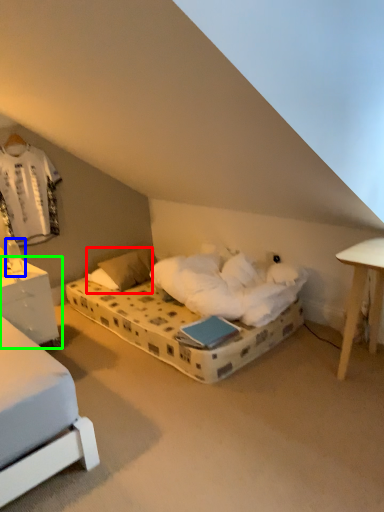
Question: Considering the real-world distances, which object is farthest from pillow (highlighted by a red box)? table lamp (highlighted by a blue box) or nightstand (highlighted by a green box)?

Choices:
 (A) table lamp
 (B) nightstand

Answer: (A)